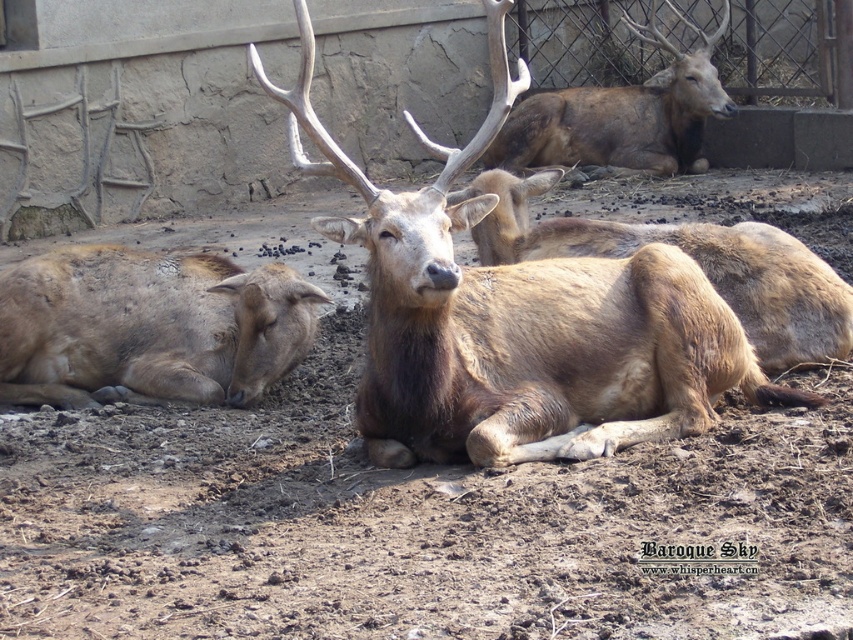
You are a zookeeper observing the deer in the enclosure. You need to check the health of both the brown fuzzy deer at lower left and the brown furry deer at upper center. Which deer is positioned lower in the image?

The brown fuzzy deer at lower left is located below the brown furry deer at upper center, so it is positioned lower in the image.

Looking at this image, you are a visitor at the zoo and see two deer in the enclosure. The first is the brown fuzzy deer at lower left, and the second is the brown furry deer at upper center. Which deer is positioned more to the left side of the enclosure?

The brown fuzzy deer at lower left is positioned more to the left side of the enclosure than the brown furry deer at upper center.